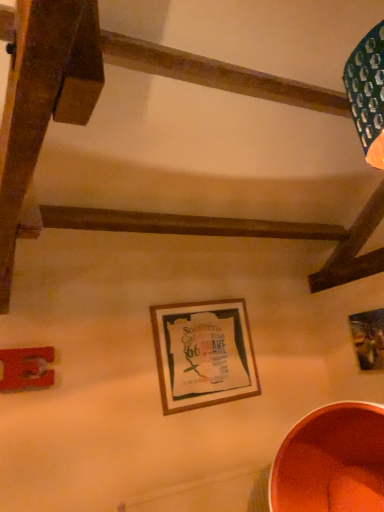
Question: Does wooden picture frame at upper right, which ranks as the third picture frame in left-to-right order, have a larger size compared to metallic copper basin at lower right?

Choices:
 (A) yes
 (B) no

Answer: (B)

Question: From the image's perspective, would you say wooden picture frame at upper right, which ranks as the third picture frame in left-to-right order, is positioned over metallic copper basin at lower right?

Choices:
 (A) yes
 (B) no

Answer: (A)

Question: Is wooden picture frame at upper right, placed as the 1th picture frame when sorted from right to left, to the right of metallic copper basin at lower right from the viewer's perspective?

Choices:
 (A) no
 (B) yes

Answer: (B)

Question: Is wooden picture frame at upper right, placed as the 1th picture frame when sorted from right to left, looking in the opposite direction of metallic copper basin at lower right?

Choices:
 (A) no
 (B) yes

Answer: (A)

Question: Does wooden picture frame at upper right, which ranks as the third picture frame in left-to-right order, have a greater height compared to metallic copper basin at lower right?

Choices:
 (A) no
 (B) yes

Answer: (A)

Question: Is metallic copper basin at lower right situated inside metallic silver picture frame at lower left, which is the third picture frame in right-to-left order, or outside?

Choices:
 (A) outside
 (B) inside

Answer: (A)

Question: In terms of height, does metallic copper basin at lower right look taller or shorter compared to metallic silver picture frame at lower left, which ranks as the 1th picture frame in left-to-right order?

Choices:
 (A) tall
 (B) short

Answer: (A)

Question: Is metallic copper basin at lower right wider or thinner than metallic silver picture frame at lower left, which ranks as the 1th picture frame in left-to-right order?

Choices:
 (A) thin
 (B) wide

Answer: (B)

Question: Is metallic copper basin at lower right in front of or behind metallic silver picture frame at lower left, which ranks as the 1th picture frame in left-to-right order, in the image?

Choices:
 (A) behind
 (B) front

Answer: (B)

Question: Is metallic copper basin at lower right to the left or to the right of wooden picture frame at upper right, placed as the 1th picture frame when sorted from right to left, in the image?

Choices:
 (A) left
 (B) right

Answer: (A)

Question: Does point (329, 463) appear closer or farther from the camera than point (380, 327)?

Choices:
 (A) closer
 (B) farther

Answer: (A)

Question: Is metallic copper basin at lower right bigger or smaller than wooden picture frame at upper right, which ranks as the third picture frame in left-to-right order?

Choices:
 (A) small
 (B) big

Answer: (B)

Question: Would you say metallic copper basin at lower right is inside or outside wooden picture frame at upper right, placed as the 1th picture frame when sorted from right to left?

Choices:
 (A) outside
 (B) inside

Answer: (A)

Question: In the image, is wooden picture frame at upper right, which ranks as the third picture frame in left-to-right order, on the left side or the right side of metallic copper basin at lower right?

Choices:
 (A) right
 (B) left

Answer: (A)

Question: In terms of width, does wooden picture frame at upper right, placed as the 1th picture frame when sorted from right to left, look wider or thinner when compared to metallic copper basin at lower right?

Choices:
 (A) thin
 (B) wide

Answer: (A)